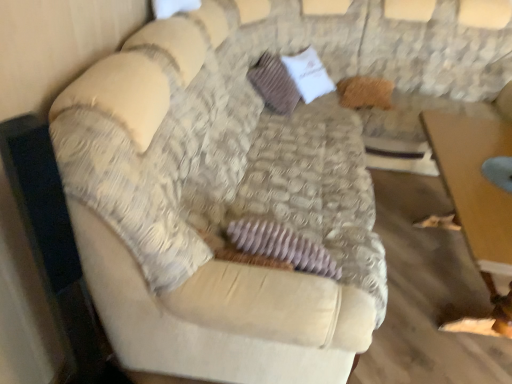
The height and width of the screenshot is (384, 512). What do you see at coordinates (274, 84) in the screenshot?
I see `brown textured pillow at center` at bounding box center [274, 84].

This screenshot has height=384, width=512. What do you see at coordinates (214, 210) in the screenshot?
I see `velvet beige couch at center` at bounding box center [214, 210].

Find the location of a particular element. This screenshot has height=384, width=512. wooden table at lower right is located at coordinates (476, 188).

Does wooden table at lower right have a greater height compared to velvet beige couch at center?

Incorrect, the height of wooden table at lower right is not larger of that of velvet beige couch at center.

From a real-world perspective, is wooden table at lower right below velvet beige couch at center?

Correct, in the physical world, wooden table at lower right is lower than velvet beige couch at center.

Can you tell me how much wooden table at lower right and velvet beige couch at center differ in facing direction?

1.69 degrees.

Does wooden table at lower right lie behind velvet beige couch at center?

Yes, wooden table at lower right is behind velvet beige couch at center.

How different are the orientations of brown textured pillow at center and velvet beige couch at center in degrees?

3.53 degrees.

Is brown textured pillow at center bigger than velvet beige couch at center?

Actually, brown textured pillow at center might be smaller than velvet beige couch at center.

Considering the relative positions of brown textured pillow at center and velvet beige couch at center in the image provided, is brown textured pillow at center to the left of velvet beige couch at center from the viewer's perspective?

No, brown textured pillow at center is not to the left of velvet beige couch at center.

From their relative heights in the image, would you say brown textured pillow at center is taller or shorter than velvet beige couch at center?

brown textured pillow at center is shorter than velvet beige couch at center.

Looking at this image, is wooden table at lower right surrounding brown textured pillow at center?

Definitely not — brown textured pillow at center is not inside wooden table at lower right.

Is wooden table at lower right bigger than brown textured pillow at center?

Yes.

How different are the orientations of wooden table at lower right and brown textured pillow at center in degrees?

They differ by 1.85 degrees in their facing directions.

How distant is wooden table at lower right from brown textured pillow at center?

wooden table at lower right is 3.48 feet away from brown textured pillow at center.

Is brown textured pillow at center closer to camera compared to wooden table at lower right?

No, brown textured pillow at center is further to the viewer.

Are brown textured pillow at center and wooden table at lower right beside each other?

brown textured pillow at center is not next to wooden table at lower right, and they're not touching.

Is velvet beige couch at center wider than brown textured pillow at center?

Indeed, velvet beige couch at center has a greater width compared to brown textured pillow at center.

Does point (245, 129) come closer to viewer compared to point (284, 94)?

Yes, point (245, 129) is in front of point (284, 94).

From the image's perspective, is velvet beige couch at center positioned above or below brown textured pillow at center?

Clearly, from the image's perspective, velvet beige couch at center is below brown textured pillow at center.

Does velvet beige couch at center appear on the left side of brown textured pillow at center?

Correct, you'll find velvet beige couch at center to the left of brown textured pillow at center.

How many degrees apart are the facing directions of velvet beige couch at center and wooden table at lower right?

1.69 degrees separate the facing orientations of velvet beige couch at center and wooden table at lower right.

Looking at their sizes, would you say velvet beige couch at center is wider or thinner than wooden table at lower right?

velvet beige couch at center is wider than wooden table at lower right.

Can you confirm if velvet beige couch at center is shorter than wooden table at lower right?

Incorrect, the height of velvet beige couch at center does not fall short of that of wooden table at lower right.

This screenshot has width=512, height=384. Find the location of `studio couch in front of the wooden table at lower right`. studio couch in front of the wooden table at lower right is located at coordinates (214, 210).

Where is `table on the right of the velvet beige couch at center`? table on the right of the velvet beige couch at center is located at coordinates (476, 188).

Where is `studio couch in front of the brown textured pillow at center`? studio couch in front of the brown textured pillow at center is located at coordinates (214, 210).

From the image, which object appears to be farther from wooden table at lower right, brown textured pillow at center or velvet beige couch at center?

brown textured pillow at center is positioned further to the anchor wooden table at lower right.

Considering their positions, is wooden table at lower right positioned closer to velvet beige couch at center than brown textured pillow at center?

The object closer to velvet beige couch at center is wooden table at lower right.

Estimate the real-world distances between objects in this image. Which object is closer to wooden table at lower right, velvet beige couch at center or brown textured pillow at center?

Among the two, velvet beige couch at center is located nearer to wooden table at lower right.

Based on their spatial positions, is brown textured pillow at center or wooden table at lower right closer to velvet beige couch at center?

wooden table at lower right is positioned closer to the anchor velvet beige couch at center.

Based on their spatial positions, is velvet beige couch at center or wooden table at lower right closer to brown textured pillow at center?

velvet beige couch at center lies closer to brown textured pillow at center than the other object.

Estimate the real-world distances between objects in this image. Which object is closer to brown textured pillow at center, wooden table at lower right or velvet beige couch at center?

velvet beige couch at center.

This screenshot has width=512, height=384. Identify the location of table positioned between velvet beige couch at center and brown textured pillow at center from near to far. (476, 188).